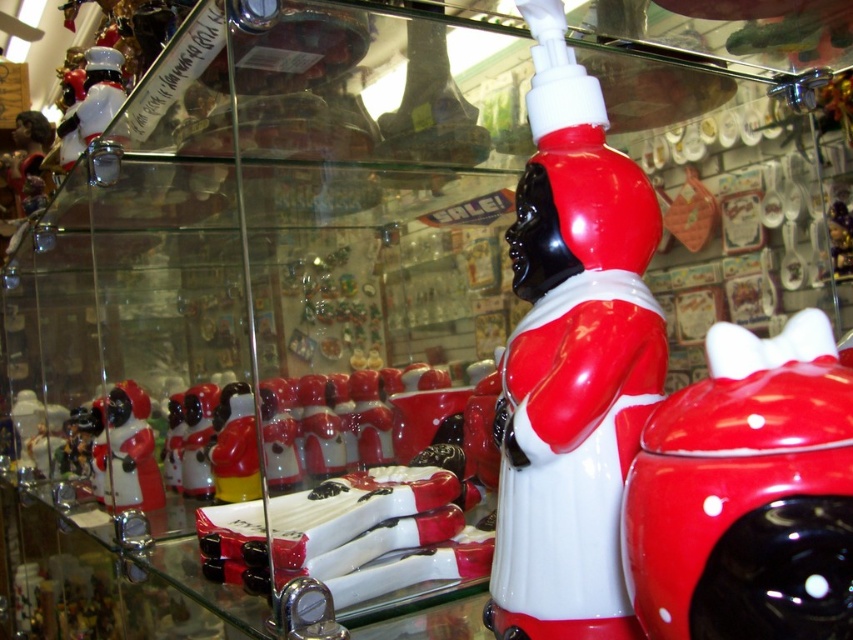
Question: Which point is farther to the camera?

Choices:
 (A) shiny ceramic santa at center
 (B) matte red cookie jar at center

Answer: (A)

Question: Among these points, which one is farthest from the camera?

Choices:
 (A) (544, 131)
 (B) (759, 349)

Answer: (A)

Question: Can you confirm if shiny ceramic santa at center is thinner than matte plastic figurine at left?

Choices:
 (A) no
 (B) yes

Answer: (B)

Question: From the image, what is the correct spatial relationship of matte red cookie jar at center in relation to shiny silver figurine at upper left?

Choices:
 (A) right
 (B) left

Answer: (A)

Question: Which of the following is the farthest from the observer?

Choices:
 (A) (97, 97)
 (B) (531, 364)

Answer: (A)

Question: Does shiny ceramic santa at center have a smaller size compared to matte plastic figurine at left?

Choices:
 (A) no
 (B) yes

Answer: (B)